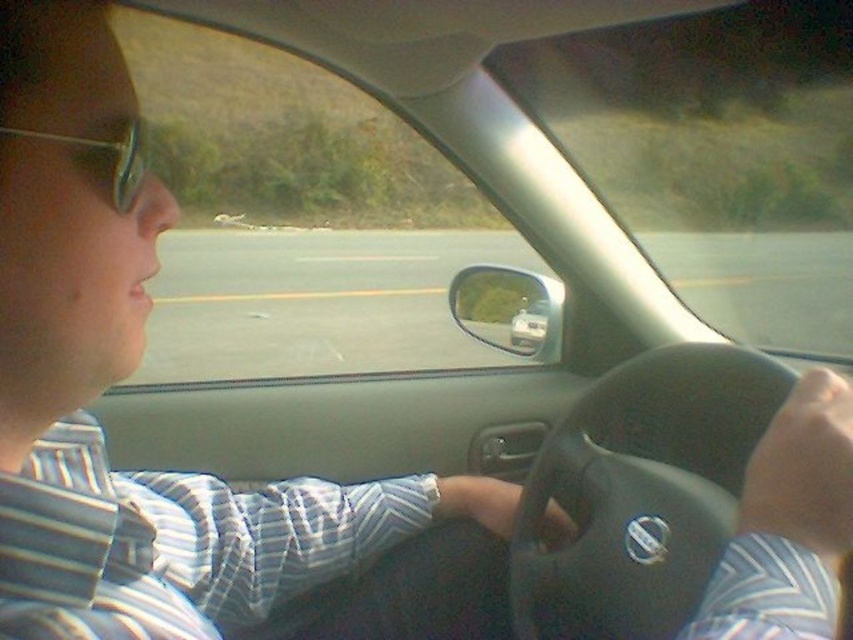
You are designing a car model and want to ensure the steering wheel is proportionate to the car. Given the black leather steering wheel at center and the metallic silver car at center in the image, which one has a larger width according to the description?

The black leather steering wheel at center has a larger width than the metallic silver car at center according to the description.